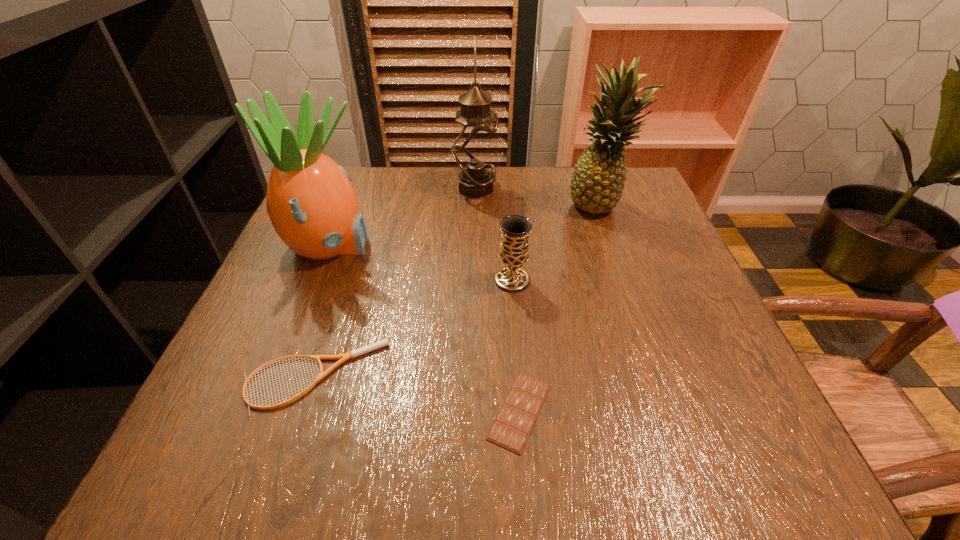
Locate an element on the screen. object at the far right corner is located at coordinates (597, 182).

Where is `free space at the far edge of the desktop`? This screenshot has width=960, height=540. free space at the far edge of the desktop is located at coordinates (419, 190).

Identify the location of vacant point at the near edge. (604, 418).

Find the location of a particular element. The width and height of the screenshot is (960, 540). vacant space at the left edge of the desktop is located at coordinates (237, 360).

Locate an element on the screen. Image resolution: width=960 pixels, height=540 pixels. blank space at the right edge is located at coordinates (655, 292).

Image resolution: width=960 pixels, height=540 pixels. Identify the location of vacant space at the near right corner. (696, 468).

The image size is (960, 540). What are the coordinates of `free space between the right pineapple and the second shortest object` in the screenshot? It's located at (457, 290).

You are a GUI agent. You are given a task and a screenshot of the screen. Output one action in this format:
    pyautogui.click(x=<x>, y=<y>)
    Task: Click on the free point between the tennis racket and the third shortest object
    This screenshot has height=540, width=960.
    Given the screenshot: What is the action you would take?
    pyautogui.click(x=414, y=328)

The width and height of the screenshot is (960, 540). Find the location of `empty space that is in between the tennis racket and the oil lamp`. empty space that is in between the tennis racket and the oil lamp is located at coordinates (395, 282).

What are the coordinates of `free space between the left pineapple and the rightmost object` in the screenshot? It's located at (464, 225).